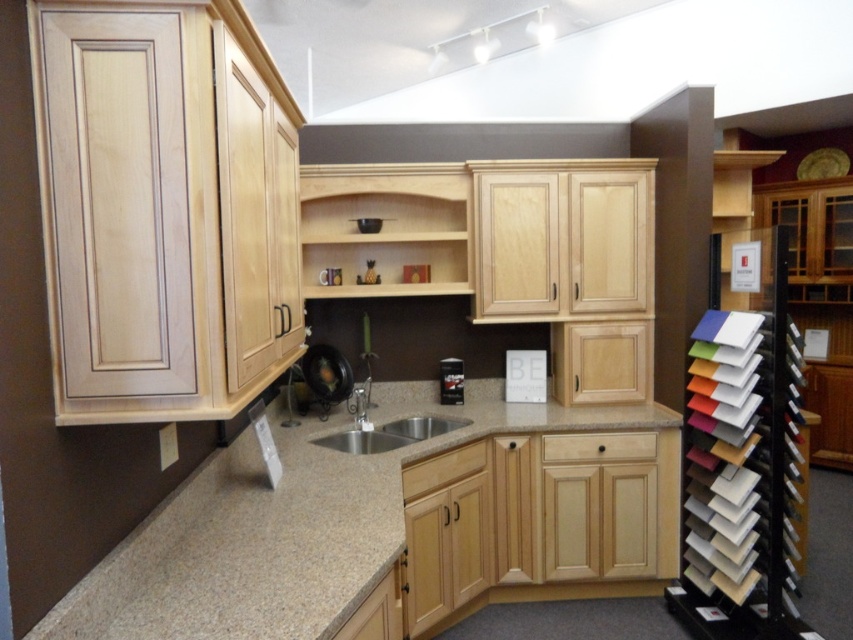
Looking at this image, you are a plumber inspecting a kitchen model. You see the stainless steel sink at center and the satin nickel faucet at center. Which object is located above the other?

The satin nickel faucet at center is located above the stainless steel sink at center because the sink is positioned under the faucet.

You are a kitchen designer assessing the layout. Which object, the granite countertop at center or the stainless steel sink at center, has a greater height in this kitchen display model?

The granite countertop at center is taller than the stainless steel sink at center according to the description provided.